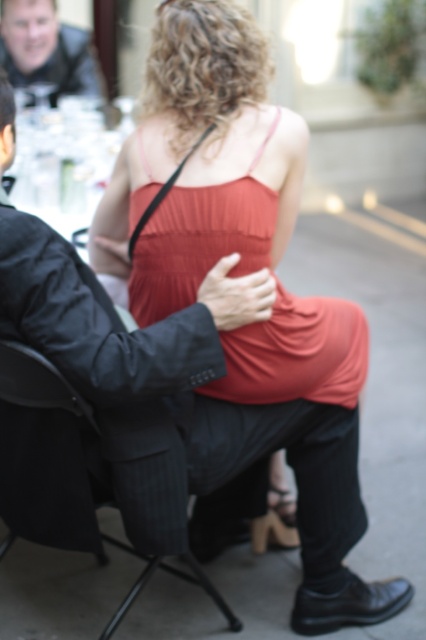
You are organizing a charity event and need to arrange seating based on the attendees clothing. You have two items of clothing to consider for a photo backdrop. The matte red dress at center and the matte black jacket at upper left. Which clothing item should be placed in a position where size matters for visibility?

The matte red dress at center should be placed in the position where size matters for visibility because it has a larger size compared to the matte black jacket at upper left, making it more noticeable and suitable for visibility purposes.

You are a photographer at an event and want to capture a candid shot of the person in the black pinstripe suit at center without them noticing. Since you can only move around the table, can you position yourself behind the black fabric chair at lower center to take the photo?

The black pinstripe suit at center is in front of the black fabric chair at lower center, so positioning yourself behind the chair would allow you to take the photo without them noticing as they are facing the chair.